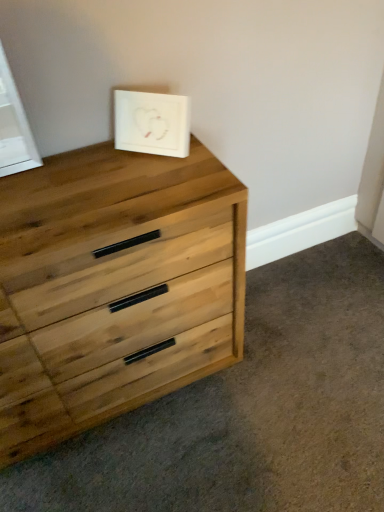
This screenshot has height=512, width=384. I want to click on free region on the left part of white matte picture frame at upper center, so click(x=99, y=160).